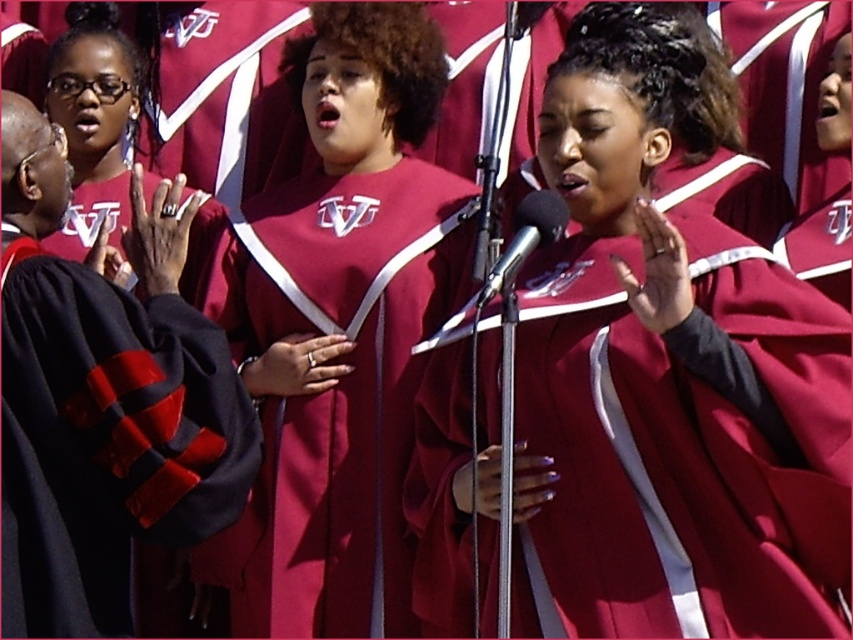
Question: Which point is farther to the camera?

Choices:
 (A) (186, 260)
 (B) (503, 275)
 (C) (836, 513)
 (D) (397, 348)

Answer: (A)

Question: Is the position of velvet black graduation gown at left more distant than that of metallic silver microphone at center?

Choices:
 (A) no
 (B) yes

Answer: (A)

Question: Can you confirm if maroon satin robe at center is thinner than velvet black graduation gown at left?

Choices:
 (A) no
 (B) yes

Answer: (A)

Question: Considering the real-world distances, which object is farthest from the velvet black graduation gown at left?

Choices:
 (A) metallic silver microphone at center
 (B) maroon fabric choir robe at center

Answer: (A)

Question: Which point is closer to the camera taking this photo?

Choices:
 (A) (236, 278)
 (B) (784, 625)

Answer: (B)

Question: Does maroon satin robe at center have a greater width compared to metallic silver microphone at center?

Choices:
 (A) yes
 (B) no

Answer: (A)